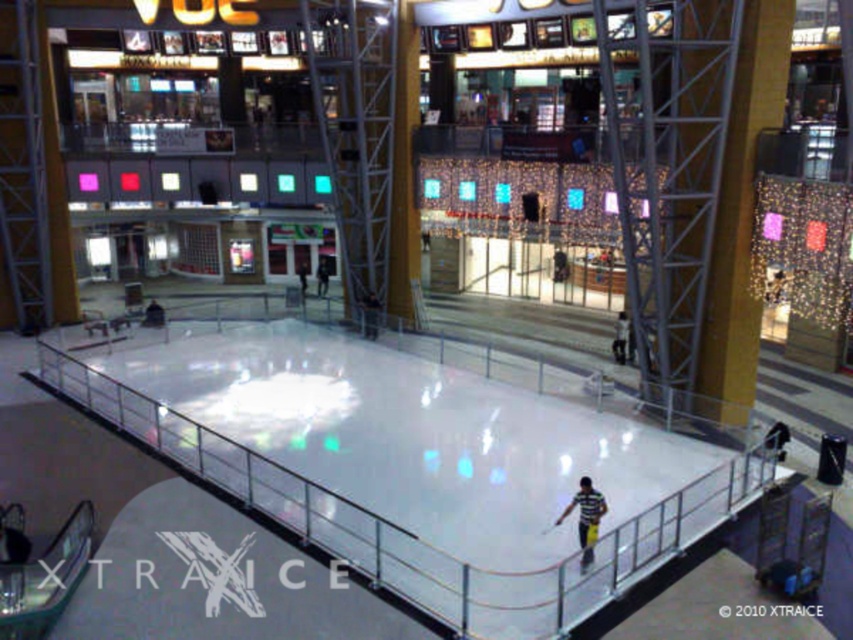
You are standing at the entrance of the mall and want to locate the ice skating rink. According to the image, where is the ice skating rink located in relation to the point marked at coordinates (418, 464)?

The point at coordinates (418, 464) corresponds to the white smooth ice skating rink at center, so the ice skating rink is exactly at that point.

You are a photographer positioned at the entrance of the mall. You want to take a photo of the white smooth ice skating rink at center and the striped shirt at center. Which object should you focus on first to ensure both are in the frame?

The white smooth ice skating rink at center is in front of the striped shirt at center, so you should focus on the white smooth ice skating rink at center first to ensure both are in the frame.